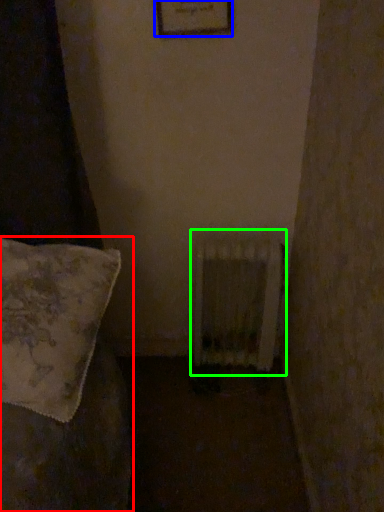
Question: Which is nearer to the furniture (highlighted by a red box)? picture frame (highlighted by a blue box) or radiator (highlighted by a green box).

Choices:
 (A) picture frame
 (B) radiator

Answer: (B)